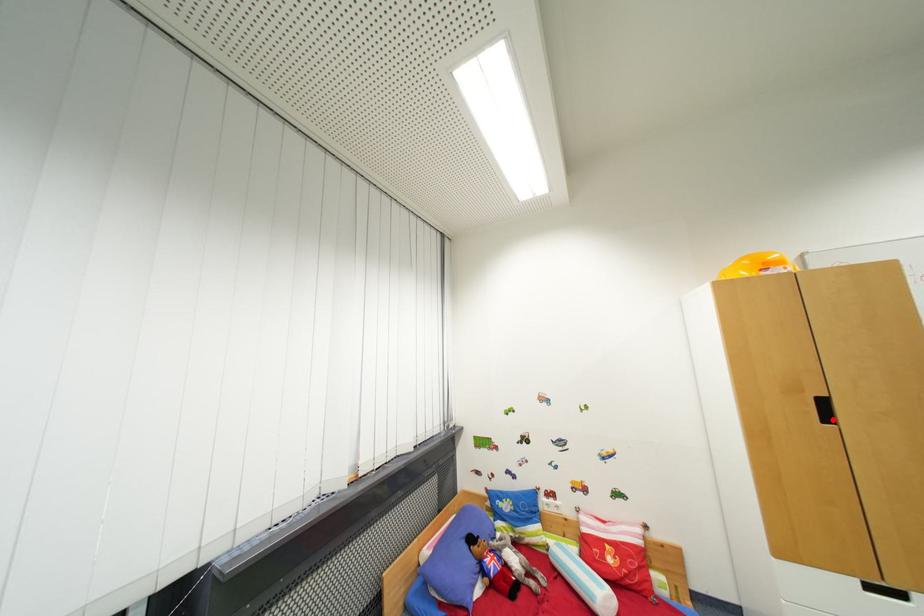
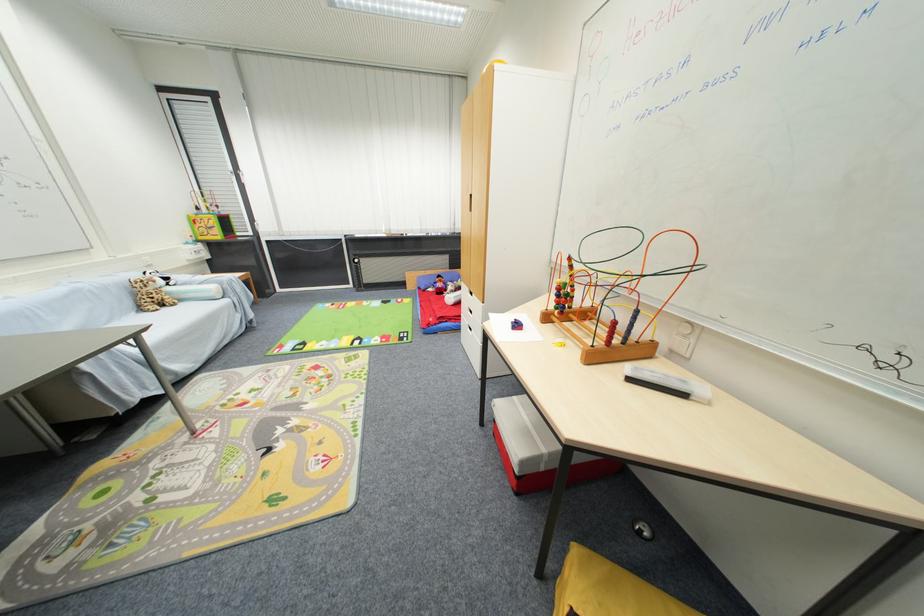
Question: I am providing you with two images of the same scene from different viewpoints. A red point is marked on the first image. Can you still see the location of the red point in image 2?

Choices:
 (A) Yes
 (B) No

Answer: (B)